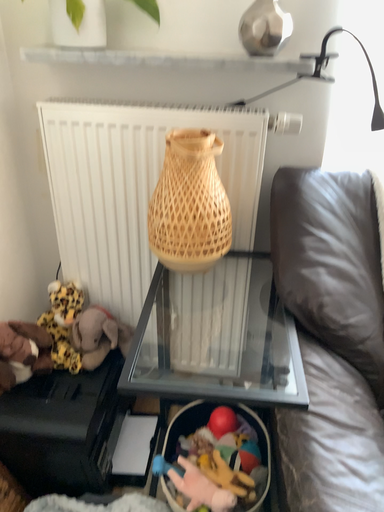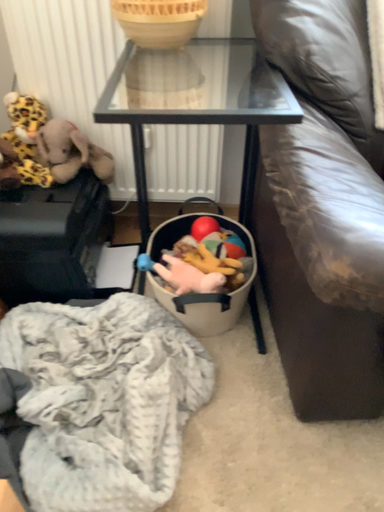
Question: How did the camera likely rotate when shooting the video?

Choices:
 (A) rotated upward
 (B) rotated downward

Answer: (B)